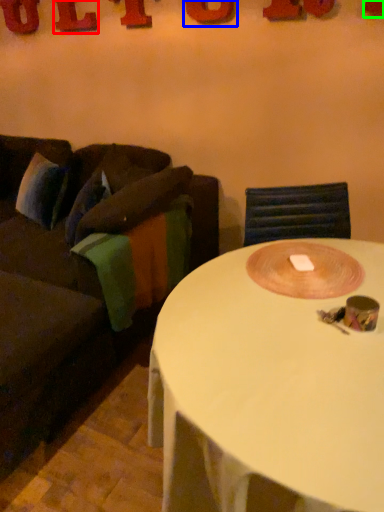
Question: Considering the real-world distances, which object is farthest from letter (highlighted by a red box)? letter (highlighted by a blue box) or letter (highlighted by a green box)?

Choices:
 (A) letter
 (B) letter

Answer: (B)